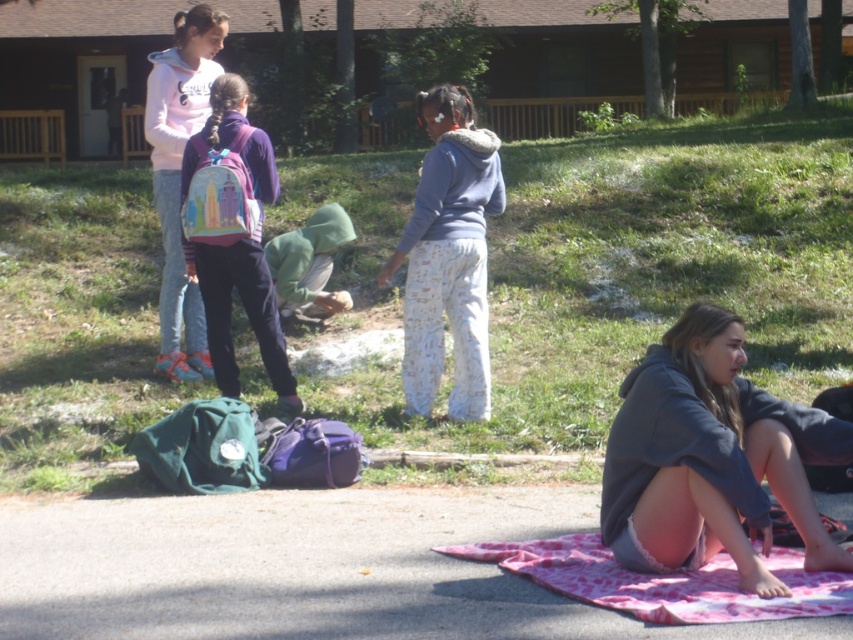
Can you confirm if gray fleece hoodie at center is positioned to the left of pastel pink backpack at center-left?

In fact, gray fleece hoodie at center is to the right of pastel pink backpack at center-left.

Who is more forward, [432,380] or [195,266]?

Point [432,380] is more forward.

Locate an element on the screen. gray fleece hoodie at center is located at coordinates (448, 257).

Between point (221, 125) and point (341, 298), which one is positioned behind?

The point (341, 298) is behind.

Is pastel pink backpack at center-left positioned before green fuzzy hoodie at center?

Yes.

Is point (265, 154) positioned after point (312, 305)?

No, it is in front of (312, 305).

Where is `pastel pink backpack at center-left`? pastel pink backpack at center-left is located at coordinates 247,312.

Is dark gray hoodie at lower right bigger than pastel pink backpack at center-left?

Correct, dark gray hoodie at lower right is larger in size than pastel pink backpack at center-left.

In the scene shown: Is dark gray hoodie at lower right to the right of pastel pink backpack at center-left from the viewer's perspective?

Correct, you'll find dark gray hoodie at lower right to the right of pastel pink backpack at center-left.

You are a GUI agent. You are given a task and a screenshot of the screen. Output one action in this format:
    pyautogui.click(x=<x>, y=<y>)
    Task: Click on the dark gray hoodie at lower right
    This screenshot has width=853, height=640.
    Given the screenshot: What is the action you would take?
    pyautogui.click(x=712, y=458)

At what (x,y) coordinates should I click in order to perform the action: click on dark gray hoodie at lower right. Please return your answer as a coordinate pair (x, y). Looking at the image, I should click on (712, 458).